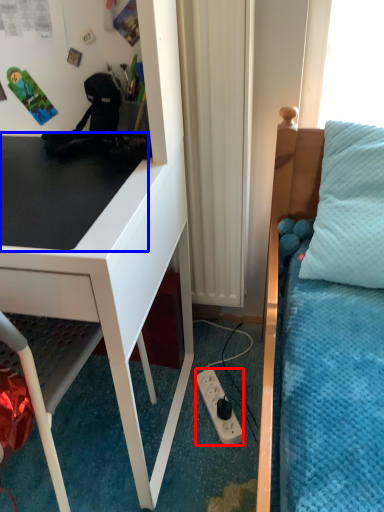
Question: Which object is further to the camera taking this photo, power outlet (highlighted by a red box) or table top (highlighted by a blue box)?

Choices:
 (A) power outlet
 (B) table top

Answer: (A)